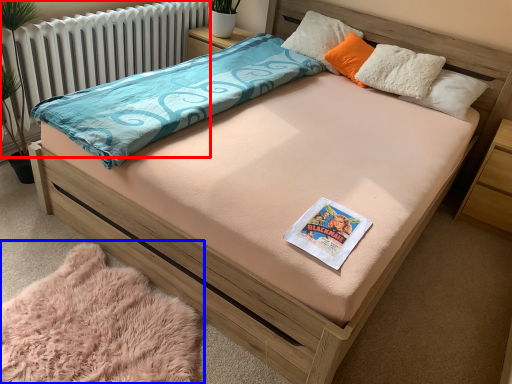
Question: Among these objects, which one is farthest to the camera, radiator (highlighted by a red box) or blanket (highlighted by a blue box)?

Choices:
 (A) radiator
 (B) blanket

Answer: (A)